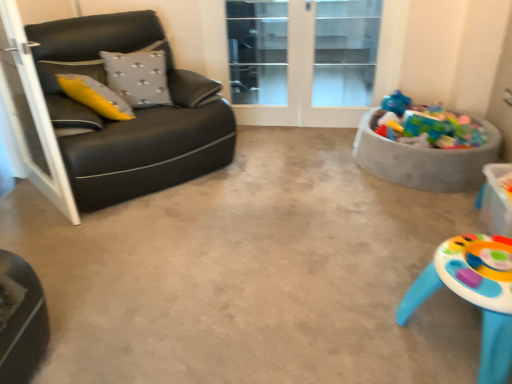
Locate an element on the screen. free location in front of black leather couch at left, which ranks as the 1th screen door in front-to-back order is located at coordinates pyautogui.click(x=50, y=233).